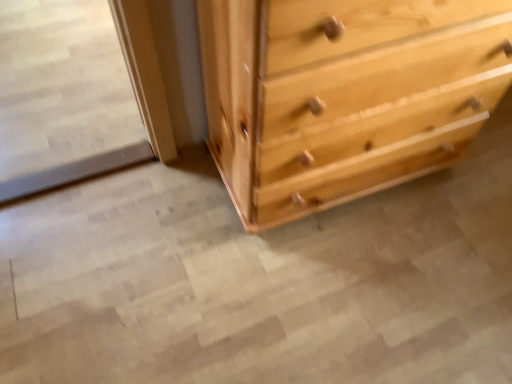
Question: From the image's perspective, is clear glass screen door at left located above or below natural wood chest of drawers at center?

Choices:
 (A) above
 (B) below

Answer: (A)

Question: Considering the positions of point (78, 173) and point (343, 43), is point (78, 173) closer or farther from the camera than point (343, 43)?

Choices:
 (A) closer
 (B) farther

Answer: (B)

Question: Based on their sizes in the image, would you say clear glass screen door at left is bigger or smaller than natural wood chest of drawers at center?

Choices:
 (A) big
 (B) small

Answer: (B)

Question: Visually, is natural wood chest of drawers at center positioned to the left or to the right of clear glass screen door at left?

Choices:
 (A) right
 (B) left

Answer: (A)

Question: Is natural wood chest of drawers at center wider or thinner than clear glass screen door at left?

Choices:
 (A) wide
 (B) thin

Answer: (B)

Question: Is point (401, 18) positioned closer to the camera than point (0, 129)?

Choices:
 (A) closer
 (B) farther

Answer: (A)

Question: From the image's perspective, is natural wood chest of drawers at center above or below clear glass screen door at left?

Choices:
 (A) above
 (B) below

Answer: (B)